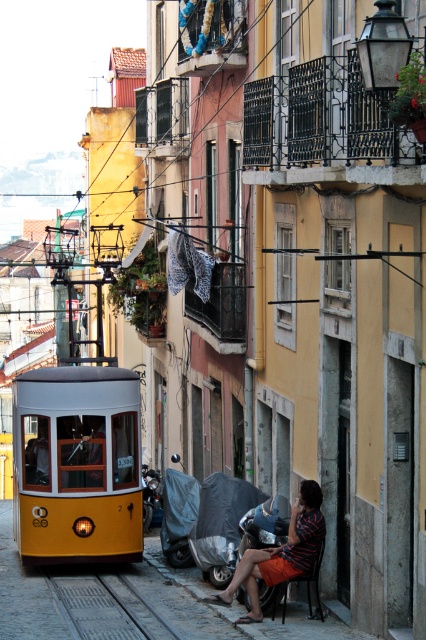
Question: Among these points, which one is farthest from the camera?

Choices:
 (A) (111, 628)
 (B) (55, 380)
 (C) (143, 520)
 (D) (302, 563)

Answer: (C)

Question: Is striped fabric shirt at lower center to the right of metallic silver motorcycle at lower center from the viewer's perspective?

Choices:
 (A) yes
 (B) no

Answer: (A)

Question: Which point is closer to the camera?

Choices:
 (A) (152, 472)
 (B) (91, 593)
 (C) (83, 429)

Answer: (B)

Question: Can you confirm if gray metallic train track at lower center is positioned to the left of striped fabric shirt at lower center?

Choices:
 (A) no
 (B) yes

Answer: (B)

Question: Is gray metallic train track at lower center below metallic silver motorcycle at lower center?

Choices:
 (A) no
 (B) yes

Answer: (B)

Question: Among these objects, which one is nearest to the camera?

Choices:
 (A) striped fabric shirt at lower center
 (B) gray metallic train track at lower center

Answer: (A)